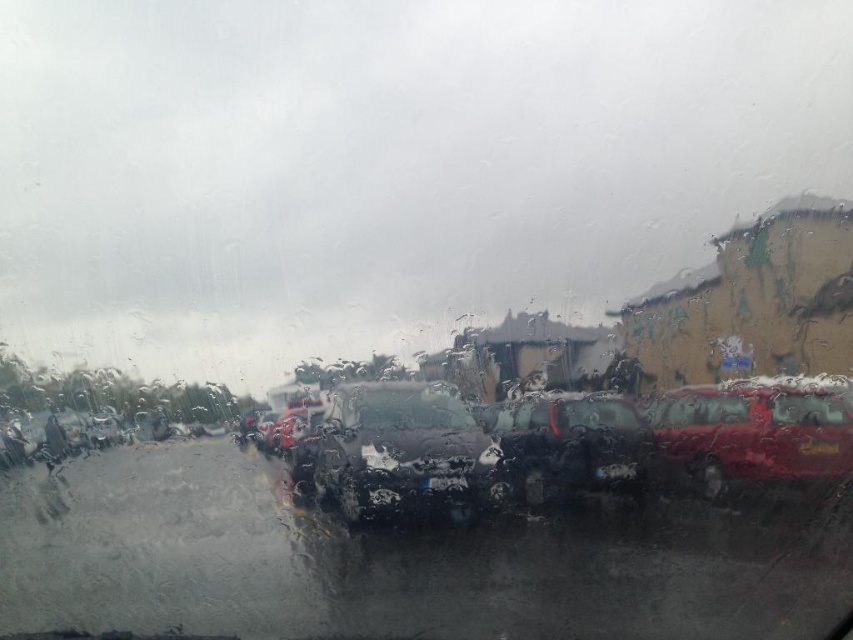
Does glossy metallic car at right have a smaller size compared to black plastic license plate at lower right?

Incorrect, glossy metallic car at right is not smaller in size than black plastic license plate at lower right.

Does point (790, 397) come farther from viewer compared to point (810, 449)?

Yes.

Image resolution: width=853 pixels, height=640 pixels. Find the location of `glossy metallic car at right`. glossy metallic car at right is located at coordinates (752, 429).